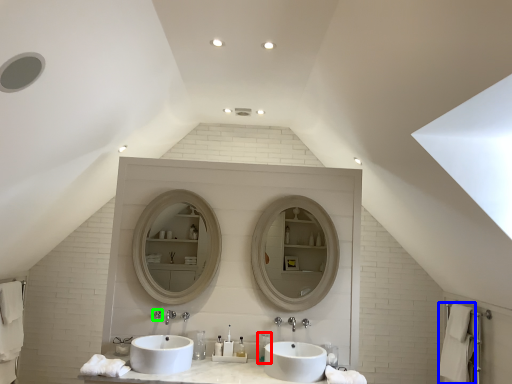
Question: Considering the real-world distances, which object is closest to toiletry (highlighted by a red box)? bath towel (highlighted by a blue box) or plumbing fixture (highlighted by a green box).

Choices:
 (A) bath towel
 (B) plumbing fixture

Answer: (B)